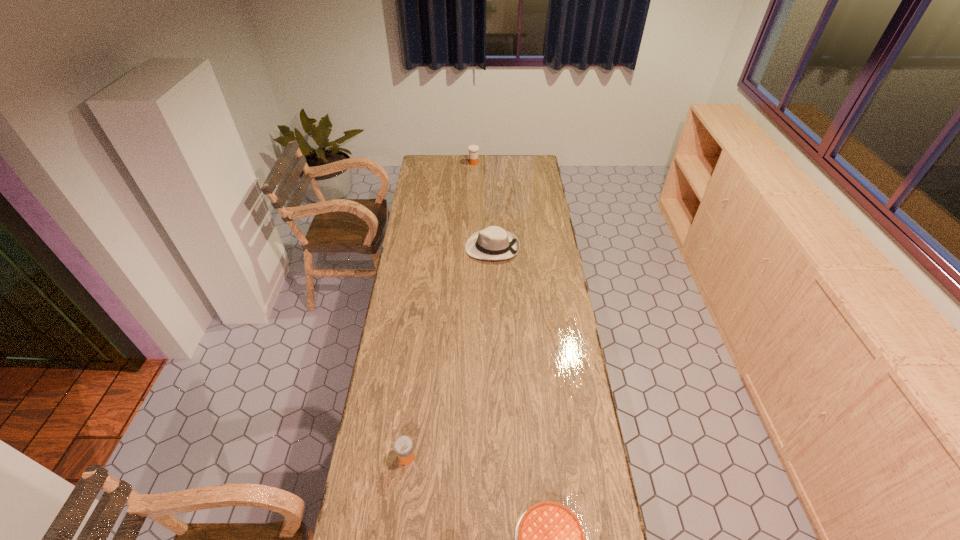
Locate an element on the screen. This screenshot has width=960, height=540. unoccupied position between the right medicine and the leftmost object is located at coordinates (441, 310).

At what (x,y) coordinates should I click in order to perform the action: click on object identified as the second closest to the nearer medicine. Please return your answer as a coordinate pair (x, y). This screenshot has height=540, width=960. Looking at the image, I should click on (494, 243).

Where is `object that is the second nearest to the farthest object`? The image size is (960, 540). object that is the second nearest to the farthest object is located at coordinates [x=403, y=445].

Identify which medicine is the second nearest to the pie. Please provide its 2D coordinates. Your answer should be formatted as a tuple, i.e. [(x, y)], where the tuple contains the x and y coordinates of a point satisfying the conditions above.

[(473, 149)]